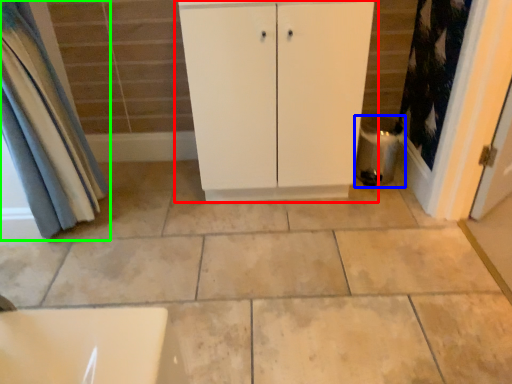
Question: Based on their relative distances, which object is farther from bathroom cabinet (highlighted by a red box)? Choose from water heater (highlighted by a blue box) and curtain (highlighted by a green box).

Choices:
 (A) water heater
 (B) curtain

Answer: (B)